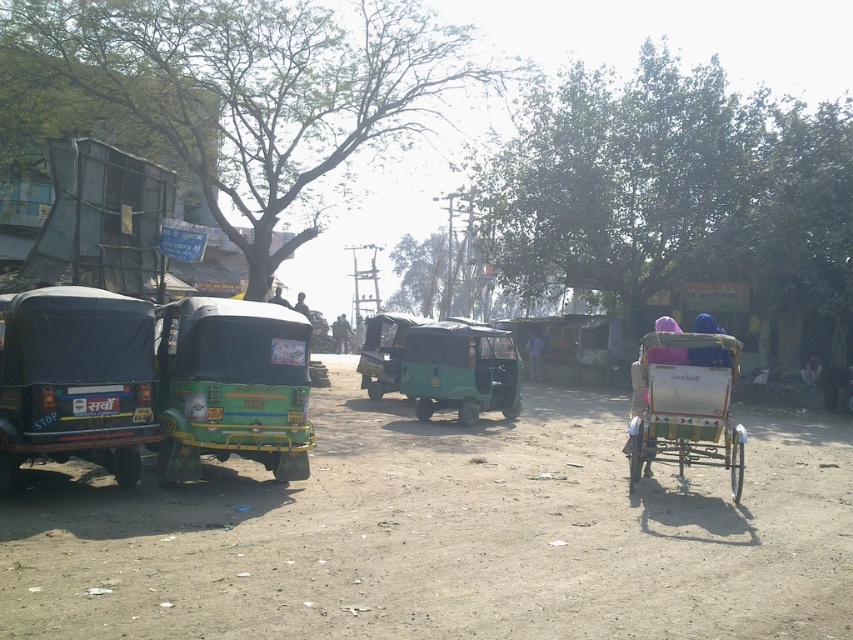
Question: Can you confirm if green painted plastic auto-rickshaw at center is positioned below dark green plastic auto-rickshaw at center?

Choices:
 (A) no
 (B) yes

Answer: (B)

Question: Which point appears farthest from the camera in this image?

Choices:
 (A) (660, 362)
 (B) (165, 316)

Answer: (A)

Question: Which point is farther from the camera taking this photo?

Choices:
 (A) (671, 324)
 (B) (299, 308)

Answer: (B)

Question: Does green painted plastic auto-rickshaw at center come behind white fabric person at center?

Choices:
 (A) no
 (B) yes

Answer: (A)

Question: Estimate the real-world distances between objects in this image. Which object is closer to the dark green plastic auto-rickshaw at center?

Choices:
 (A) white fabric person at center
 (B) green matte auto-rickshaw at center

Answer: (A)

Question: Is green matte auto-rickshaw at center bigger than light brown wooden chair at center?

Choices:
 (A) no
 (B) yes

Answer: (A)